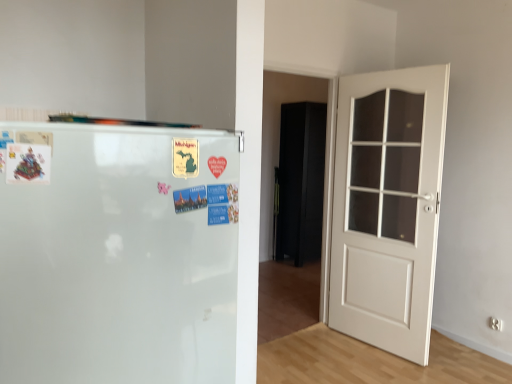
The image size is (512, 384). Find the location of `free point to the right of white wooden door at right`. free point to the right of white wooden door at right is located at coordinates (461, 362).